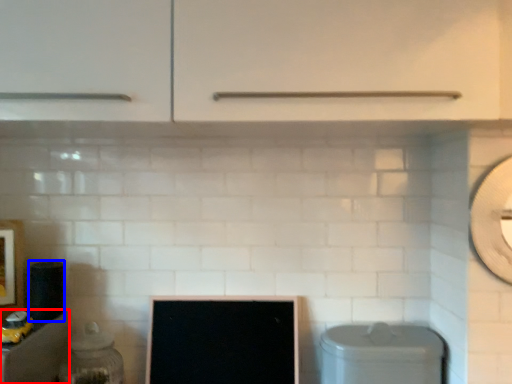
Question: Which object is closer to the camera taking this photo, cabinetry (highlighted by a red box) or appliance (highlighted by a blue box)?

Choices:
 (A) cabinetry
 (B) appliance

Answer: (A)